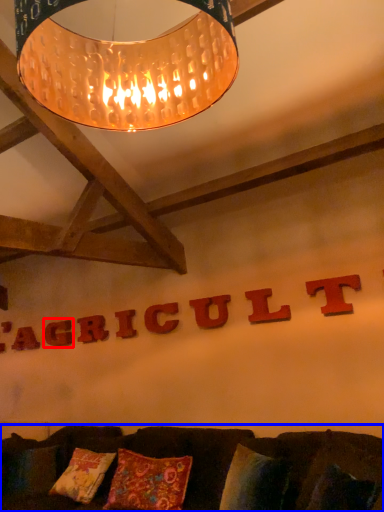
Question: Which object is further to the camera taking this photo, letter (highlighted by a red box) or furniture (highlighted by a blue box)?

Choices:
 (A) letter
 (B) furniture

Answer: (A)